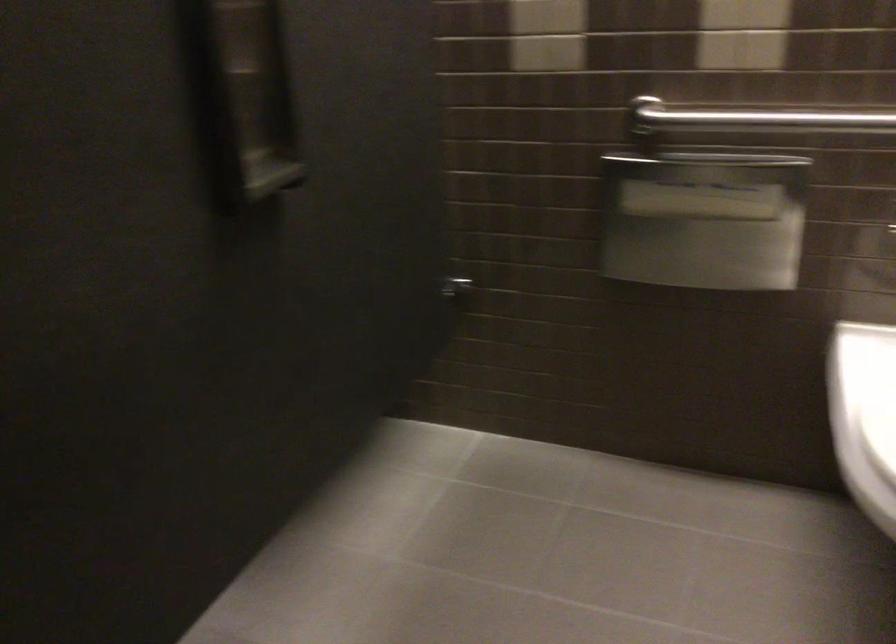
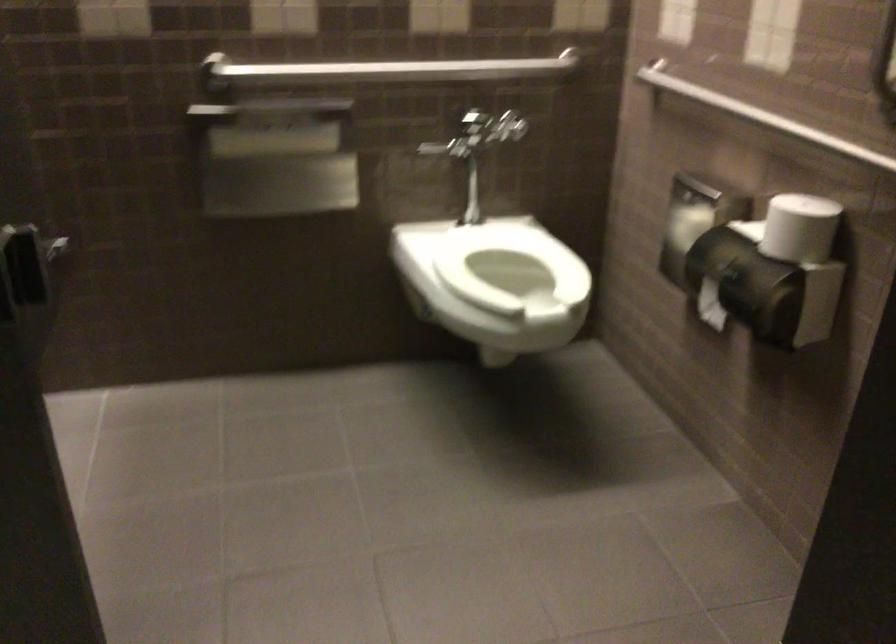
The point at (694, 203) is marked in the first image. Where is the corresponding point in the second image?

(273, 143)